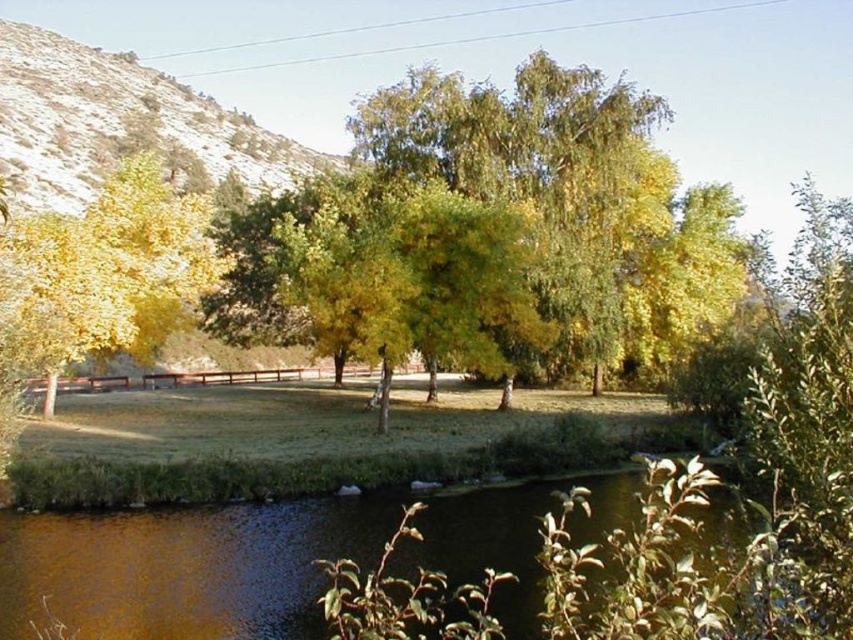
Question: Can you confirm if brown liquid water at lower center is positioned to the right of yellow leafy tree at left?

Choices:
 (A) yes
 (B) no

Answer: (A)

Question: Is brown liquid water at lower center behind yellow leafy tree at left?

Choices:
 (A) no
 (B) yes

Answer: (A)

Question: Which of the following is the farthest from the observer?

Choices:
 (A) yellow leafy tree at left
 (B) brown liquid water at lower center

Answer: (A)

Question: Which object is farther from the camera taking this photo?

Choices:
 (A) yellow leafy tree at left
 (B) brown liquid water at lower center

Answer: (A)

Question: Does brown liquid water at lower center appear under yellow leafy tree at left?

Choices:
 (A) yes
 (B) no

Answer: (A)